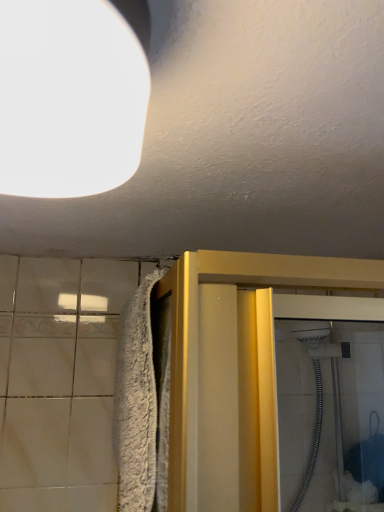
What is the approximate height of white matte light fixture at upper left?

white matte light fixture at upper left is 4.04 inches in height.

Where is `white matte light fixture at upper left`? white matte light fixture at upper left is located at coordinates (69, 98).

What do you see at coordinates (69, 98) in the screenshot?
I see `white matte light fixture at upper left` at bounding box center [69, 98].

In order to face white fluffy bath towel at left, should I rotate leftwards or rightwards?

To align with it, rotate left about 7.583°.

What are the coordinates of `white fluffy bath towel at left` in the screenshot? It's located at (140, 408).

What do you see at coordinates (140, 408) in the screenshot?
I see `white fluffy bath towel at left` at bounding box center [140, 408].

At what (x,y) coordinates should I click in order to perform the action: click on white matte light fixture at upper left. Please return your answer as a coordinate pair (x, y). Looking at the image, I should click on (69, 98).

From the picture: Considering the positions of objects white matte light fixture at upper left and white fluffy bath towel at left in the image provided, who is more to the left, white matte light fixture at upper left or white fluffy bath towel at left?

Positioned to the left is white matte light fixture at upper left.

Is white matte light fixture at upper left in front of white fluffy bath towel at left?

Yes, white matte light fixture at upper left is closer to the viewer.

Based on the photo, which is closer to the camera, (97, 168) or (145, 309)?

The point (97, 168) is more forward.

From the image's perspective, is white matte light fixture at upper left located beneath white fluffy bath towel at left?

No, from the image's perspective, white matte light fixture at upper left is not beneath white fluffy bath towel at left.

From a real-world perspective, who is located higher, white matte light fixture at upper left or white fluffy bath towel at left?

From a 3D spatial view, white matte light fixture at upper left is above.

Does white matte light fixture at upper left have a lesser width compared to white fluffy bath towel at left?

No.

Considering the sizes of white matte light fixture at upper left and white fluffy bath towel at left in the image, is white matte light fixture at upper left taller or shorter than white fluffy bath towel at left?

white matte light fixture at upper left is shorter than white fluffy bath towel at left.

Is white matte light fixture at upper left smaller than white fluffy bath towel at left?

Yes, white matte light fixture at upper left is smaller than white fluffy bath towel at left.

Looking at this image, is white matte light fixture at upper left spatially inside white fluffy bath towel at left, or outside of it?

white matte light fixture at upper left exists outside the volume of white fluffy bath towel at left.

Are white matte light fixture at upper left and white fluffy bath towel at left far apart?

No, white matte light fixture at upper left is in close proximity to white fluffy bath towel at left.

Is white matte light fixture at upper left turned away from white fluffy bath towel at left?

No, white matte light fixture at upper left is not facing away from white fluffy bath towel at left.

Looking at this image, how many degrees apart are the facing directions of white matte light fixture at upper left and white fluffy bath towel at left?

Result: The angular difference between white matte light fixture at upper left and white fluffy bath towel at left is 177 degrees.

Image resolution: width=384 pixels, height=512 pixels. I want to click on bath towel that appears on the right of white matte light fixture at upper left, so click(140, 408).

Is white fluffy bath towel at left at the right side of white matte light fixture at upper left?

Yes.

Based on the photo, is white fluffy bath towel at left behind white matte light fixture at upper left?

Yes, the depth of white fluffy bath towel at left is greater than that of white matte light fixture at upper left.

Does point (118, 458) come in front of point (7, 67)?

No, (118, 458) is behind (7, 67).

From the image's perspective, does white fluffy bath towel at left appear lower than white matte light fixture at upper left?

Correct, white fluffy bath towel at left appears lower than white matte light fixture at upper left in the image.

From a real-world perspective, who is located lower, white fluffy bath towel at left or white matte light fixture at upper left?

white fluffy bath towel at left.

Can you confirm if white fluffy bath towel at left is wider than white matte light fixture at upper left?

No, white fluffy bath towel at left is not wider than white matte light fixture at upper left.

Considering the relative sizes of white fluffy bath towel at left and white matte light fixture at upper left in the image provided, is white fluffy bath towel at left shorter than white matte light fixture at upper left?

Incorrect, the height of white fluffy bath towel at left does not fall short of that of white matte light fixture at upper left.

Who is smaller, white fluffy bath towel at left or white matte light fixture at upper left?

Smaller between the two is white matte light fixture at upper left.

Is white matte light fixture at upper left a part of white fluffy bath towel at left?

No, white matte light fixture at upper left is not a part of white fluffy bath towel at left.

Is white fluffy bath towel at left touching white matte light fixture at upper left?

white fluffy bath towel at left and white matte light fixture at upper left are clearly separated.

Is white fluffy bath towel at left turned away from white matte light fixture at upper left?

No, white fluffy bath towel at left is not facing away from white matte light fixture at upper left.

Looking at this image, measure the distance from white fluffy bath towel at left to white matte light fixture at upper left.

14.71 inches.

Identify the location of lighting positioned vertically above the white fluffy bath towel at left (from a real-world perspective). This screenshot has height=512, width=384. (69, 98).

At what (x,y) coordinates should I click in order to perform the action: click on lighting that appears above the white fluffy bath towel at left (from a real-world perspective). Please return your answer as a coordinate pair (x, y). Looking at the image, I should click on (69, 98).

Where is `lighting that appears in front of the white fluffy bath towel at left`? The width and height of the screenshot is (384, 512). lighting that appears in front of the white fluffy bath towel at left is located at coordinates (69, 98).